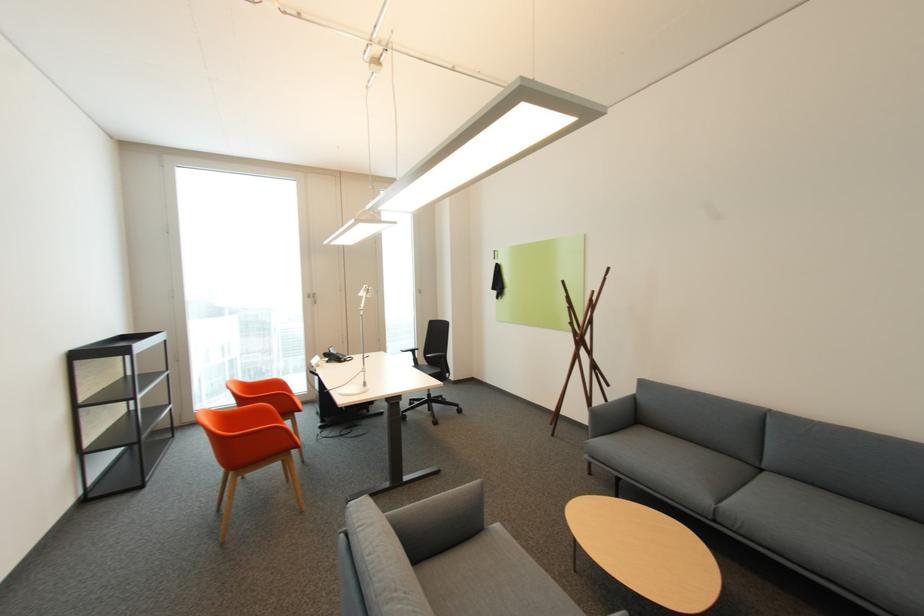
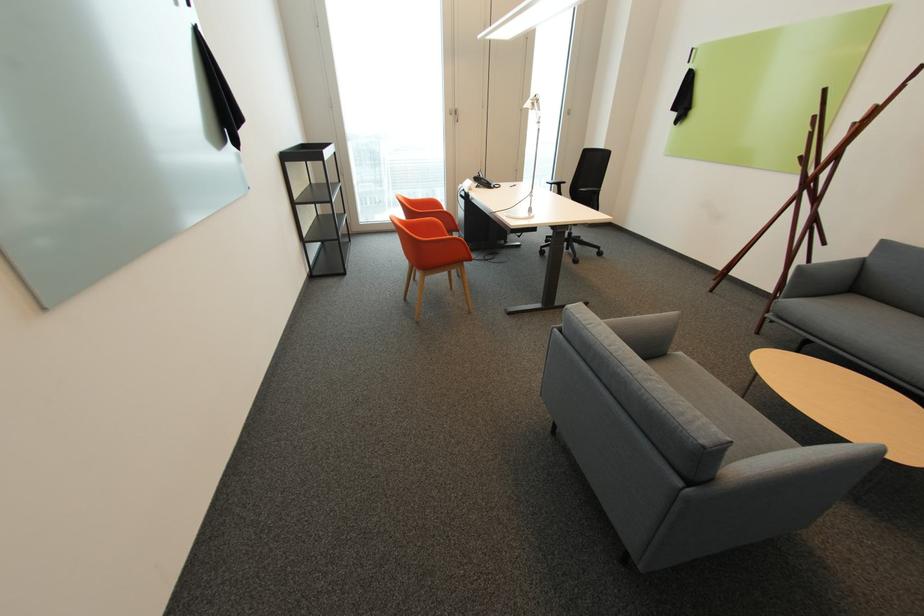
Where in the second image is the point corresponding to [392,519] from the first image?

(610, 323)